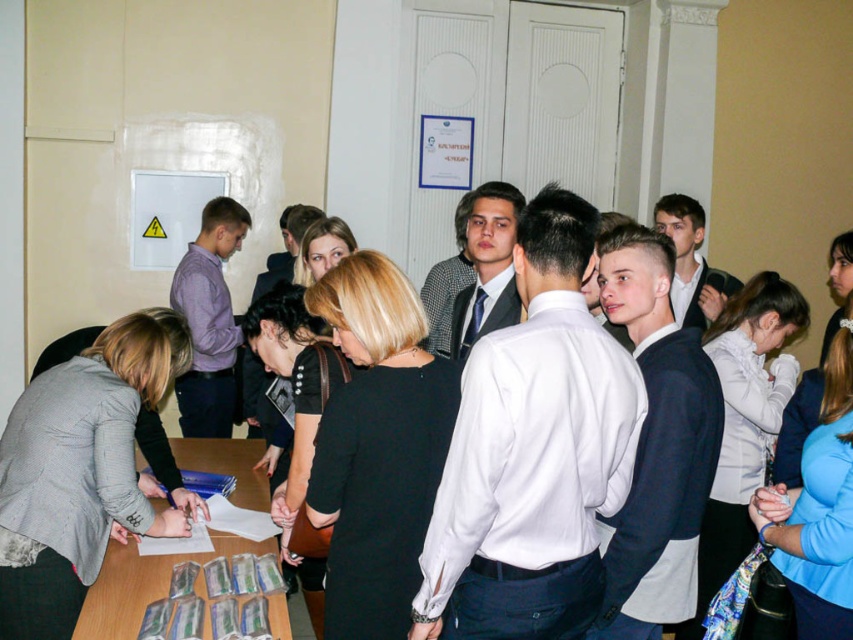
You are standing at the entrance of the room and see the gray fabric jacket at lower left and the wooden table at lower left. Which object is closer to the left edge of the room?

The gray fabric jacket at lower left is positioned on the left side of the wooden table at lower left, so it is closer to the left edge of the room.

You are a person who needs to sit down at the wooden table at lower left. There is a gray fabric jacket at lower left on the chair. Can you sit on the chair without moving the jacket?

The gray fabric jacket at lower left is thinner than the wooden table at lower left. Since the jacket is thinner, it can be folded or moved aside to make space for sitting, so yes, you can sit on the chair without moving the jacket if there is enough space remaining.